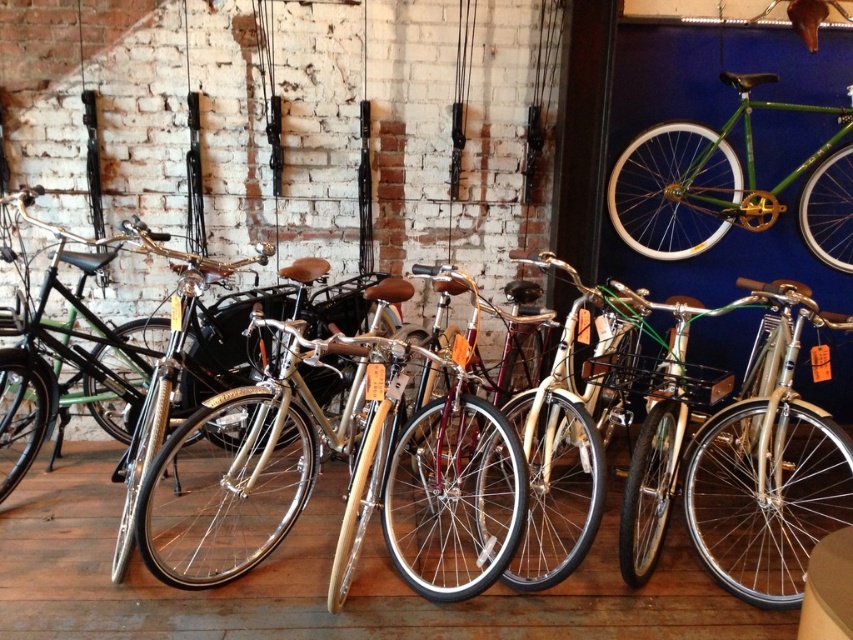
Does shiny silver bicycle at center have a greater height compared to shiny gold bicycle at center?

Yes.

Where is `shiny silver bicycle at center`? shiny silver bicycle at center is located at coordinates (370, 477).

Is point (782, 564) closer to viewer compared to point (372, 454)?

No, (782, 564) is behind (372, 454).

Locate an element on the screen. shiny silver bicycle at center is located at coordinates (370, 477).

Is shiny gold bicycle at center smaller than green matte bicycle at upper right?

No.

Image resolution: width=853 pixels, height=640 pixels. Describe the element at coordinates (432, 486) in the screenshot. I see `shiny gold bicycle at center` at that location.

Locate an element on the screen. This screenshot has height=640, width=853. shiny gold bicycle at center is located at coordinates (432, 486).

Locate an element on the screen. This screenshot has width=853, height=640. shiny gold bicycle at center is located at coordinates (432, 486).

Does shiny silver bicycle at center have a lesser width compared to green matte bicycle at upper right?

In fact, shiny silver bicycle at center might be wider than green matte bicycle at upper right.

Does point (224, 518) lie in front of point (622, 157)?

Yes, it is in front of point (622, 157).

Locate an element on the screen. Image resolution: width=853 pixels, height=640 pixels. shiny silver bicycle at center is located at coordinates (370, 477).